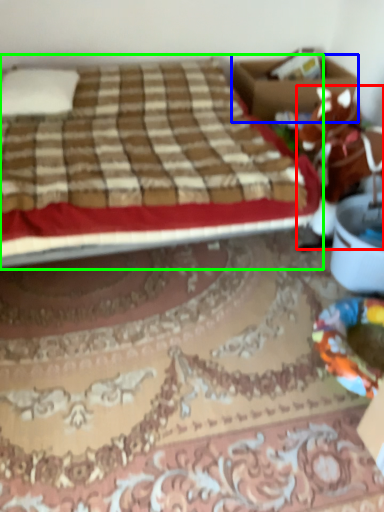
Question: Considering the real-world distances, which object is closest to animal (highlighted by a red box)? box (highlighted by a blue box) or bed (highlighted by a green box).

Choices:
 (A) box
 (B) bed

Answer: (B)